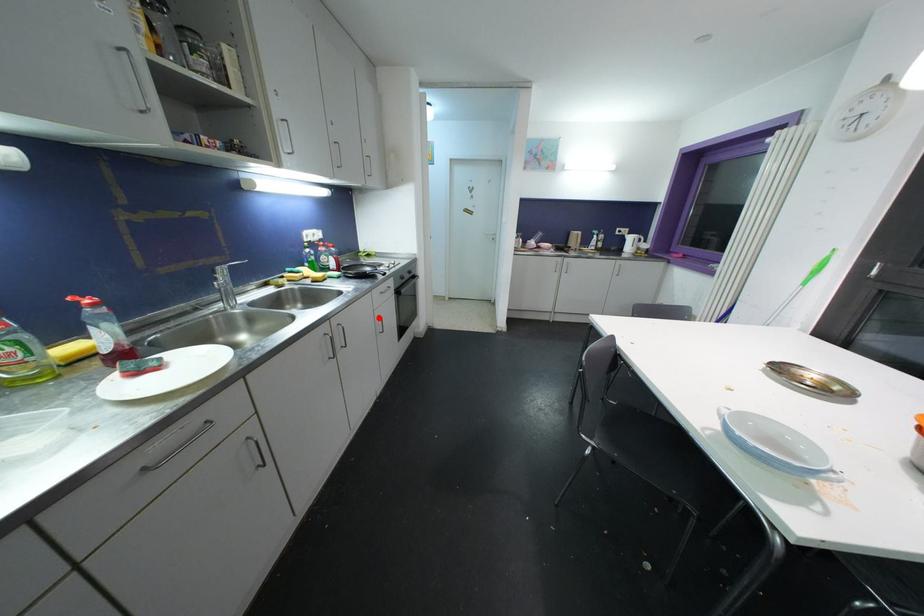
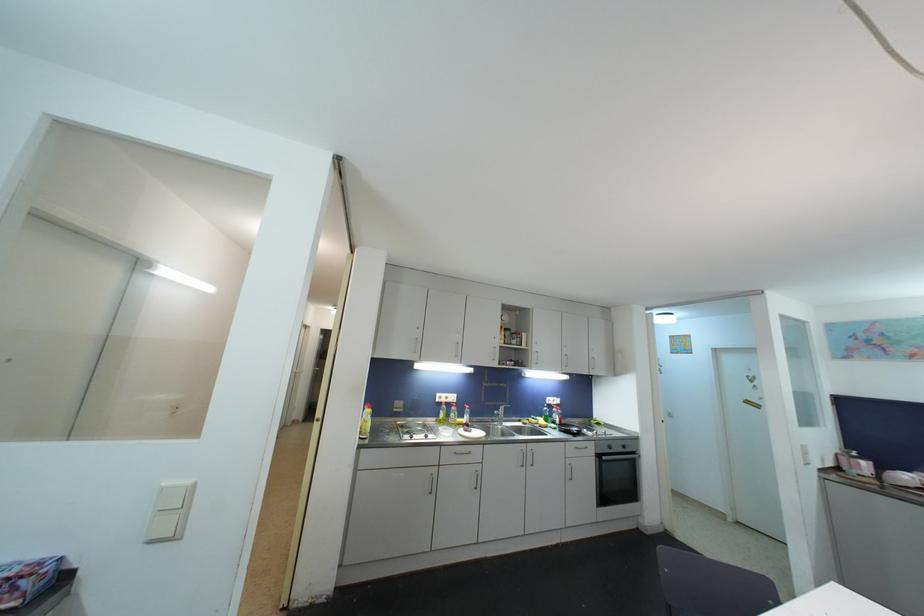
Question: I am providing you with two images of the same scene from different viewpoints. In image1, a red point is highlighted. Considering the same 3D point in image2, which of the following is correct?

Choices:
 (A) It is closer
 (B) It is farther

Answer: (B)